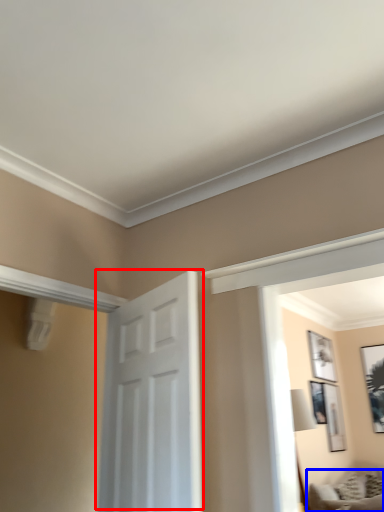
Question: Among these objects, which one is nearest to the camera, door (highlighted by a red box) or furniture (highlighted by a blue box)?

Choices:
 (A) door
 (B) furniture

Answer: (A)